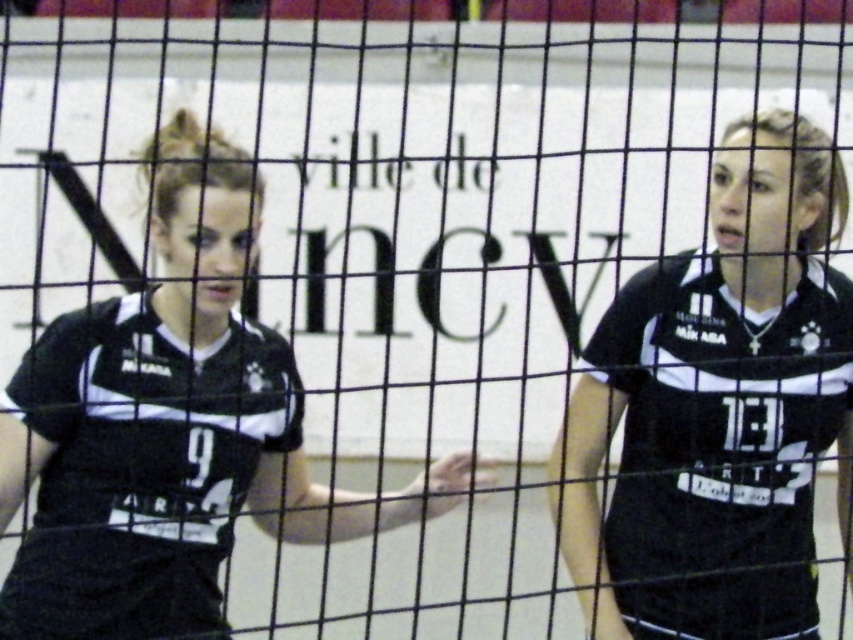
Between point (820, 426) and point (51, 339), which one is positioned behind?

Positioned behind is point (820, 426).

Can you confirm if black matte jersey at center is positioned above matte black jersey at center?

No.

Is point (845, 374) less distant than point (146, 433)?

No, (845, 374) is further to viewer.

Locate an element on the screen. The image size is (853, 640). black matte jersey at center is located at coordinates (718, 408).